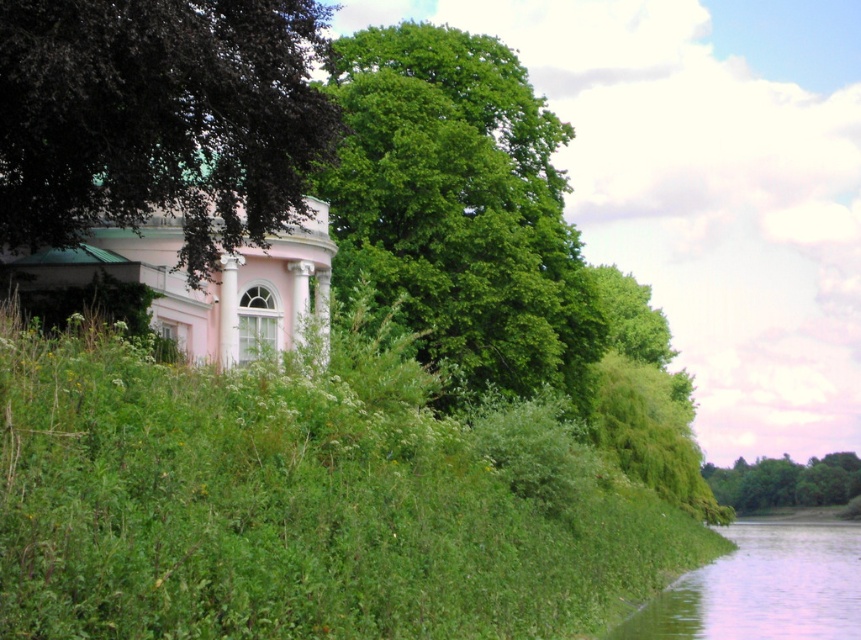
Question: Which object appears farthest from the camera in this image?

Choices:
 (A) clear water at lower right
 (B) green leafy tree at center

Answer: (B)

Question: Is green leafy tree at center smaller than clear water at lower right?

Choices:
 (A) yes
 (B) no

Answer: (A)

Question: Which point appears closest to the camera in this image?

Choices:
 (A) (694, 595)
 (B) (265, 179)

Answer: (B)

Question: Can you confirm if dark green leafy tree at upper left is positioned above clear water at lower right?

Choices:
 (A) no
 (B) yes

Answer: (B)

Question: Does dark green leafy tree at upper left come in front of clear water at lower right?

Choices:
 (A) yes
 (B) no

Answer: (A)

Question: Which object is positioned closest to the green leafy tree at lower right?

Choices:
 (A) clear water at lower right
 (B) dark green leafy tree at upper left
 (C) green leafy tree at center

Answer: (A)